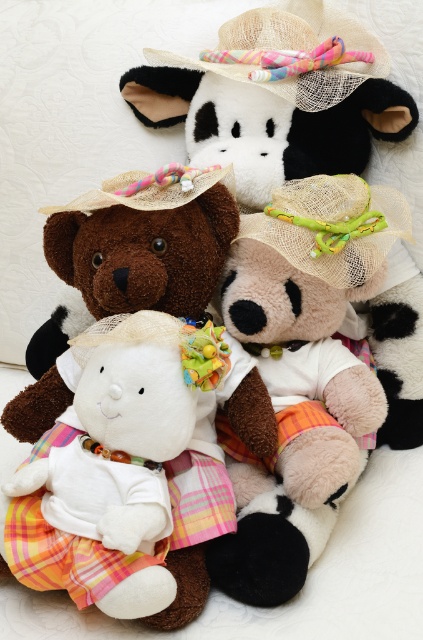
Question: Is fluffy beige teddy bear at center below braided straw hat at center?

Choices:
 (A) yes
 (B) no

Answer: (A)

Question: Does straw hat at upper center have a lesser width compared to straw hat at center?

Choices:
 (A) yes
 (B) no

Answer: (B)

Question: Which object appears closest to the camera in this image?

Choices:
 (A) fluffy beige teddy bear at center
 (B) white plush teddy bear at center
 (C) braided straw hat at center

Answer: (B)

Question: Does fluffy beige teddy bear at center come in front of white plush teddy bear at center?

Choices:
 (A) yes
 (B) no

Answer: (B)

Question: Which of the following is the closest to the observer?

Choices:
 (A) (120, 246)
 (B) (131, 182)
 (C) (354, 51)

Answer: (A)

Question: Which of the following is the closest to the observer?

Choices:
 (A) (255, 22)
 (B) (286, 198)

Answer: (B)